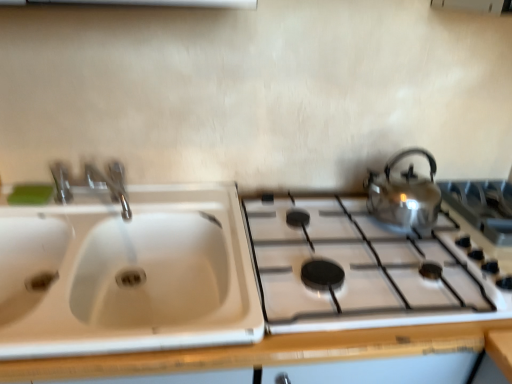
Question: Is shiny metallic kettle at right far away from shiny metallic gas stove at right, arranged as the second gas stove when viewed from the right?

Choices:
 (A) no
 (B) yes

Answer: (A)

Question: From a real-world perspective, is shiny metallic kettle at right on shiny metallic gas stove at right, the 1th gas stove viewed from the left?

Choices:
 (A) yes
 (B) no

Answer: (A)

Question: Would you say shiny metallic kettle at right is outside shiny metallic gas stove at right, arranged as the second gas stove when viewed from the right?

Choices:
 (A) yes
 (B) no

Answer: (A)

Question: From a real-world perspective, is shiny metallic kettle at right under shiny metallic gas stove at right, the 1th gas stove viewed from the left?

Choices:
 (A) yes
 (B) no

Answer: (B)

Question: From the image's perspective, would you say shiny metallic kettle at right is shown under shiny metallic gas stove at right, arranged as the second gas stove when viewed from the right?

Choices:
 (A) yes
 (B) no

Answer: (B)

Question: From their relative heights in the image, would you say green matte soap at upper left is taller or shorter than shiny metallic kettle at right?

Choices:
 (A) short
 (B) tall

Answer: (A)

Question: From the image's perspective, is green matte soap at upper left located above or below shiny metallic kettle at right?

Choices:
 (A) above
 (B) below

Answer: (B)

Question: Considering the positions of point (32, 188) and point (390, 216), is point (32, 188) closer or farther from the camera than point (390, 216)?

Choices:
 (A) closer
 (B) farther

Answer: (B)

Question: Considering the relative positions of green matte soap at upper left and shiny metallic kettle at right in the image provided, is green matte soap at upper left to the left or to the right of shiny metallic kettle at right?

Choices:
 (A) right
 (B) left

Answer: (B)

Question: In terms of height, does shiny metallic kettle at right look taller or shorter compared to white plastic sink at left?

Choices:
 (A) short
 (B) tall

Answer: (A)

Question: Is shiny metallic kettle at right in front of or behind white plastic sink at left in the image?

Choices:
 (A) front
 (B) behind

Answer: (B)

Question: Based on their sizes in the image, would you say shiny metallic kettle at right is bigger or smaller than white plastic sink at left?

Choices:
 (A) big
 (B) small

Answer: (B)

Question: Is shiny metallic kettle at right wider or thinner than white plastic sink at left?

Choices:
 (A) wide
 (B) thin

Answer: (B)

Question: Based on their positions, is shiny metallic kettle at right located to the left or right of satin silver gas stove at right, which is the first gas stove from right to left?

Choices:
 (A) right
 (B) left

Answer: (B)

Question: In the image, is shiny metallic kettle at right positioned in front of or behind satin silver gas stove at right, the 2th gas stove from the left?

Choices:
 (A) front
 (B) behind

Answer: (A)